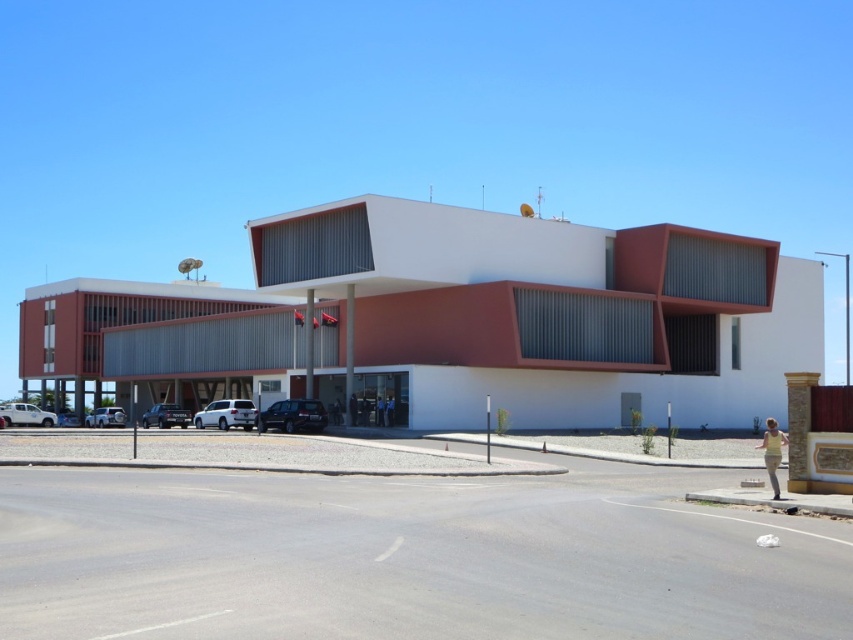
Question: Which point is closer to the camera?

Choices:
 (A) (169, 416)
 (B) (196, 426)
 (C) (310, 413)
 (D) (16, 403)

Answer: (C)

Question: Based on their relative distances, which object is nearer to the yellow fabric at lower right?

Choices:
 (A) black leather jacket at center
 (B) satin silver suv at center

Answer: (A)

Question: Does satin silver suv at center have a lesser width compared to white matte truck at lower left?

Choices:
 (A) yes
 (B) no

Answer: (A)

Question: Can you confirm if satin silver suv at center is positioned to the left of blue uniformed man at center?

Choices:
 (A) yes
 (B) no

Answer: (A)

Question: Can you confirm if satin silver suv at center is positioned above blue uniformed man at center?

Choices:
 (A) yes
 (B) no

Answer: (B)

Question: Which of these objects is positioned closest to the satin black car at lower left?

Choices:
 (A) black leather jacket at center
 (B) yellow fabric at lower right

Answer: (A)